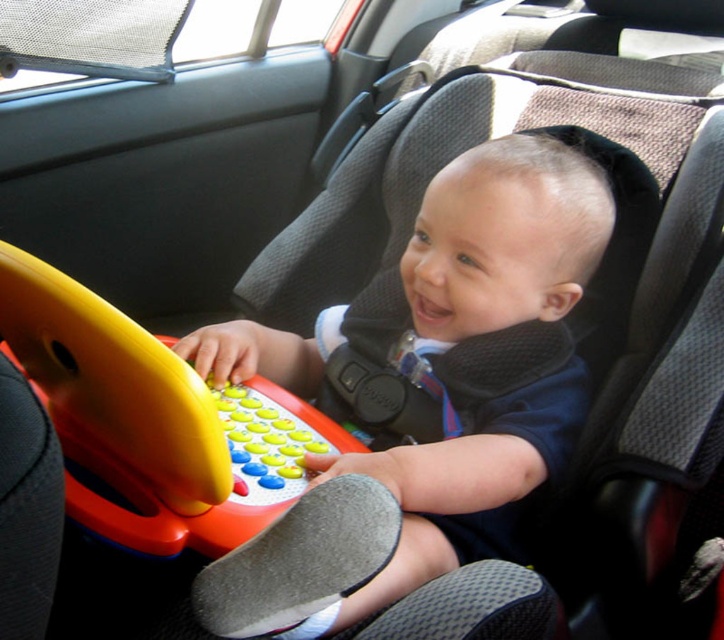
You are a safety inspector checking the distance between the matte plastic toy at center and the child in the car seat. According to safety guidelines, toys must be at least 24 inches away from the child to prevent injury in case of sudden stops. Is the current distance compliant with the safety guidelines?

The matte plastic toy at center is 23.38 inches away from viewer, which is less than the required 24 inches. Therefore, it does not comply with the safety guidelines and should be moved further away.

You are a parent checking the safety of your child in the car. You see the matte plastic toy at center and the rubberized plastic toy at center. Which toy is on top of the other?

The matte plastic toy at center is positioned over the rubberized plastic toy at center, so the matte plastic toy is on top.

You are a parent checking the safety of your child in the car. You notice two toys on the child seat. The matte plastic toy at center and the rubberized plastic toy at center. Which toy is positioned to the right of the other?

The matte plastic toy at center is positioned to the right of the rubberized plastic toy at center.